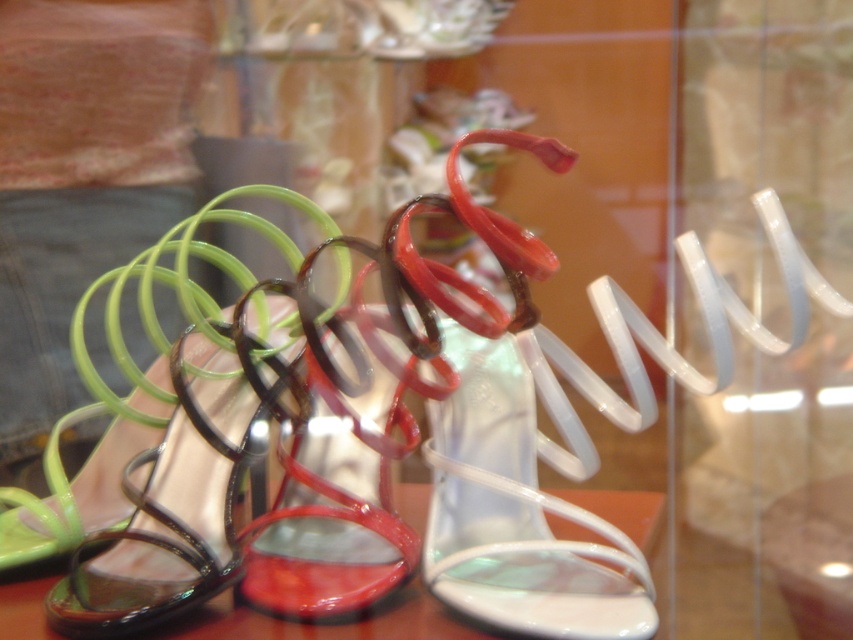
You are a customer at a shoe store and want to choose a pair of sandals. You see the glossy plastic sandal at center and the green glossy sandal at left. Which one is narrower?

The glossy plastic sandal at center is narrower than the green glossy sandal at left.